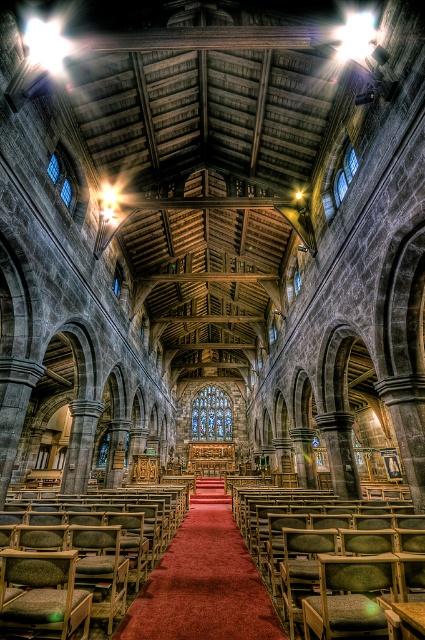
Does stained glass window at center have a greater height compared to transparent stained glass window at upper center?

Yes.

Between stained glass window at center and transparent stained glass window at upper center, which one is positioned higher?

transparent stained glass window at upper center is above.

Find the location of a particular element. The image size is (425, 640). stained glass window at center is located at coordinates (212, 413).

Identify the location of stained glass window at center. This screenshot has width=425, height=640. (212, 413).

Who is taller, carpeted aisle at center or clear glass window at upper left?

carpeted aisle at center is taller.

Is point (255, 600) closer to camera compared to point (53, 180)?

Yes, it is in front of point (53, 180).

Locate an element on the screen. The image size is (425, 640). carpeted aisle at center is located at coordinates (204, 580).

Between wooden textured bench at center and clear glass window at upper center, which one has less height?

With less height is clear glass window at upper center.

Who is more distant from viewer, (283,557) or (354,164)?

The point (354,164) is behind.

At what (x,y) coordinates should I click in order to perform the action: click on wooden textured bench at center. Please return your answer as a coordinate pair (x, y). The width and height of the screenshot is (425, 640). Looking at the image, I should click on (282, 531).